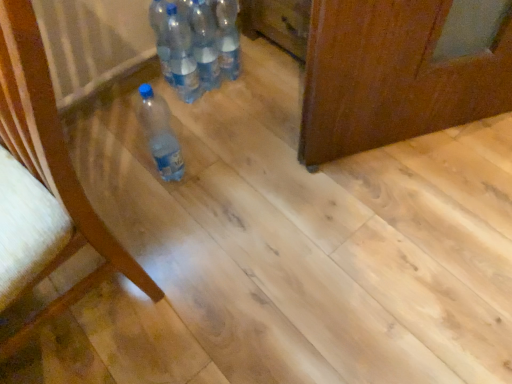
You are a GUI agent. You are given a task and a screenshot of the screen. Output one action in this format:
    pyautogui.click(x=<x>, y=<y>)
    Task: Click on the free space to the left of translucent plastic bottle at lower left, marked as the 1th bottle in a bottom-to-top arrangement
    
    Given the screenshot: What is the action you would take?
    pyautogui.click(x=122, y=172)